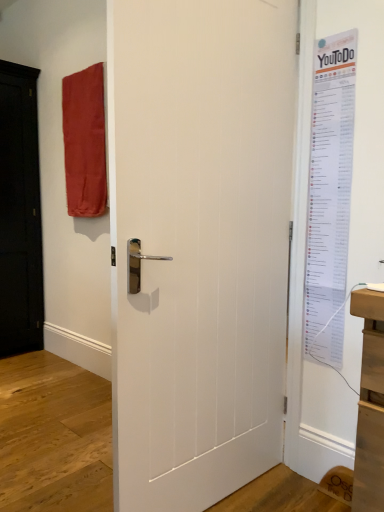
Question: Would you say matte red fabric at upper left is a long distance from white matte door at center?

Choices:
 (A) no
 (B) yes

Answer: (B)

Question: Does matte red fabric at upper left have a greater width compared to white matte door at center?

Choices:
 (A) no
 (B) yes

Answer: (B)

Question: Considering the relative positions of matte red fabric at upper left and white matte door at center in the image provided, is matte red fabric at upper left behind white matte door at center?

Choices:
 (A) yes
 (B) no

Answer: (A)

Question: Considering the relative sizes of matte red fabric at upper left and white matte door at center in the image provided, is matte red fabric at upper left taller than white matte door at center?

Choices:
 (A) no
 (B) yes

Answer: (A)

Question: Is matte red fabric at upper left next to white matte door at center?

Choices:
 (A) yes
 (B) no

Answer: (B)

Question: From the image's perspective, is matte red fabric at upper left above white matte door at center?

Choices:
 (A) no
 (B) yes

Answer: (B)

Question: Is white matte door at center shorter than matte red fabric at upper left?

Choices:
 (A) yes
 (B) no

Answer: (B)

Question: Can you confirm if white matte door at center is wider than matte red fabric at upper left?

Choices:
 (A) no
 (B) yes

Answer: (A)

Question: From a real-world perspective, is white matte door at center on matte red fabric at upper left?

Choices:
 (A) no
 (B) yes

Answer: (A)

Question: Is white matte door at center positioned beyond the bounds of matte red fabric at upper left?

Choices:
 (A) no
 (B) yes

Answer: (B)

Question: Is white matte door at center turned away from matte red fabric at upper left?

Choices:
 (A) no
 (B) yes

Answer: (B)

Question: Considering the relative positions of white matte door at center and matte red fabric at upper left in the image provided, is white matte door at center to the right of matte red fabric at upper left from the viewer's perspective?

Choices:
 (A) yes
 (B) no

Answer: (A)

Question: Does white matte door at center have a greater width compared to white paper poster at right?

Choices:
 (A) no
 (B) yes

Answer: (B)